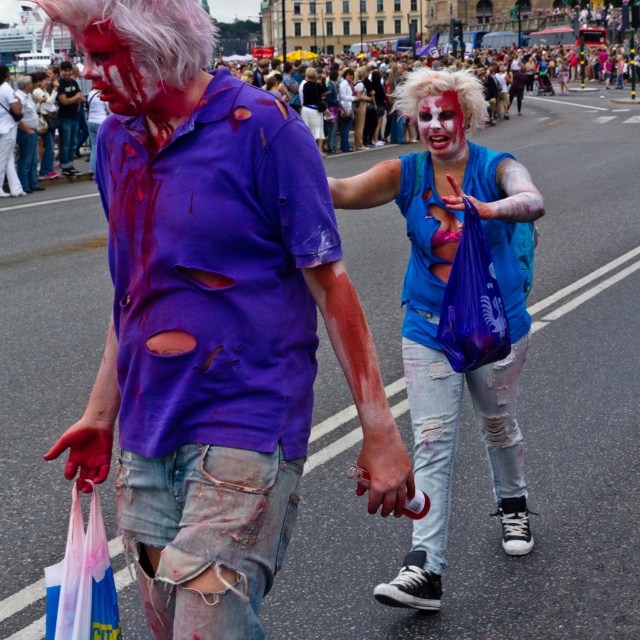
Can you confirm if matte white face at center is thinner than ripped denim shorts at center?

Correct, matte white face at center's width is less than ripped denim shorts at center's.

Does point (435, 129) come in front of point (68, 68)?

Yes, point (435, 129) is closer to viewer.

The image size is (640, 640). Find the location of `matte white face at center`. matte white face at center is located at coordinates (442, 125).

Between point (161, 83) and point (61, 77), which one is positioned behind?

Positioned behind is point (61, 77).

Can you confirm if matte white face at upper left is positioned to the left of ripped denim shorts at center?

No, matte white face at upper left is not to the left of ripped denim shorts at center.

The height and width of the screenshot is (640, 640). I want to click on matte white face at upper left, so click(x=116, y=72).

Does blue ripped jeans at center appear under matte white face at upper left?

Yes, blue ripped jeans at center is below matte white face at upper left.

Which is in front, point (524, 308) or point (96, 72)?

Point (96, 72) is more forward.

Identify the location of blue ripped jeans at center. (449, 364).